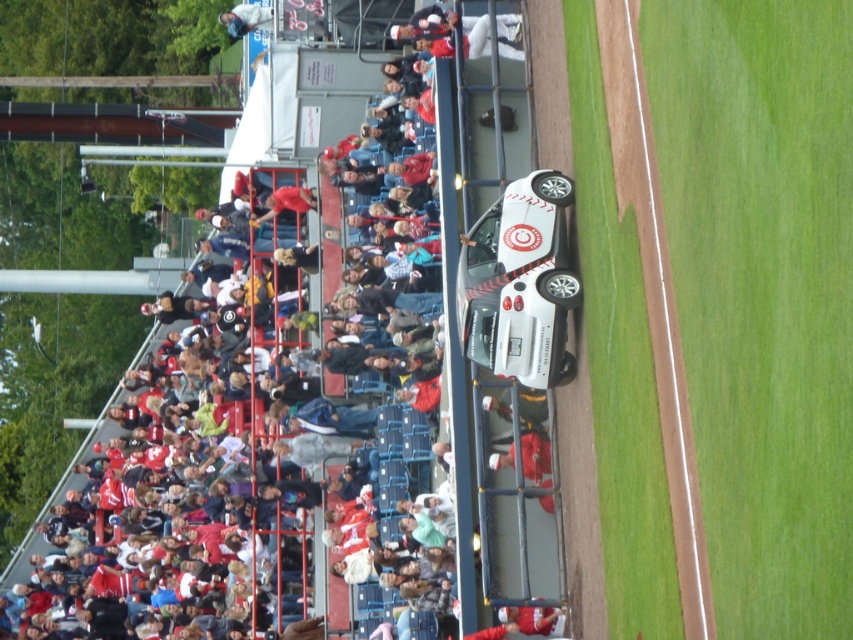
Question: Is brown dirt track at center thinner than white matte race car at upper center?

Choices:
 (A) no
 (B) yes

Answer: (B)

Question: Is brown dirt track at center wider than white plastic cup at upper center?

Choices:
 (A) yes
 (B) no

Answer: (B)

Question: Is brown dirt track at center closer to the viewer compared to white plastic cup at upper center?

Choices:
 (A) no
 (B) yes

Answer: (B)

Question: Which point is farther from the camera taking this photo?

Choices:
 (A) (496, 321)
 (B) (244, 6)

Answer: (B)

Question: Which object is closer to the camera taking this photo?

Choices:
 (A) white matte race car at upper center
 (B) brown dirt track at center

Answer: (B)

Question: Which of these objects is positioned closest to the white plastic cup at upper center?

Choices:
 (A) white matte race car at upper center
 (B) brown dirt track at center

Answer: (A)